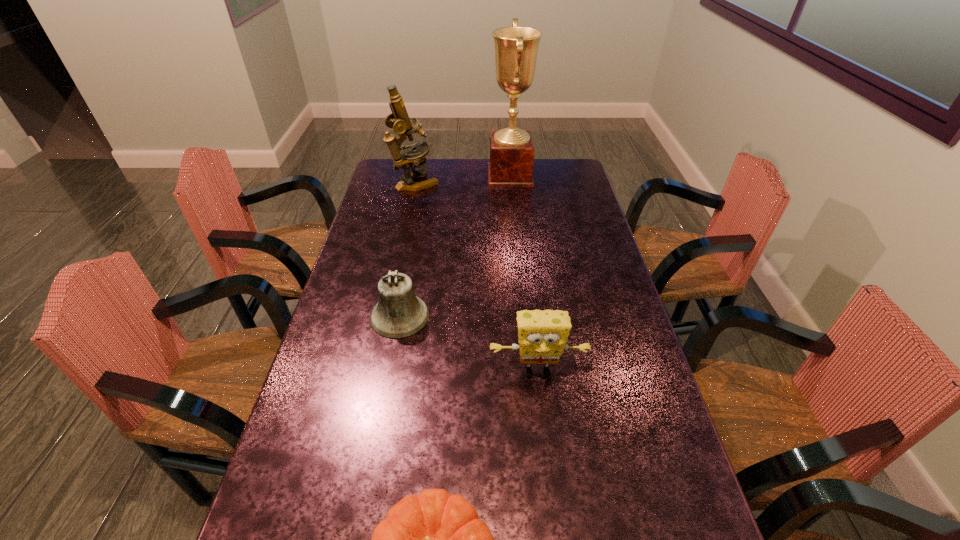
Find the location of a particular element. trophy cup that is at the far edge is located at coordinates (512, 151).

The height and width of the screenshot is (540, 960). Identify the location of microscope present at the far edge. (399, 120).

The width and height of the screenshot is (960, 540). Identify the location of microscope that is at the left edge. (399, 120).

Identify the location of bell located at the left edge. The height and width of the screenshot is (540, 960). (398, 314).

This screenshot has height=540, width=960. Find the location of `object present at the far left corner`. object present at the far left corner is located at coordinates (399, 120).

In the image, there is a desktop. Where is `vacant space at the far edge`? The height and width of the screenshot is (540, 960). vacant space at the far edge is located at coordinates (428, 176).

The height and width of the screenshot is (540, 960). Identify the location of free region at the left edge of the desktop. (386, 200).

The width and height of the screenshot is (960, 540). I want to click on vacant area at the right edge of the desktop, so click(608, 294).

In the image, there is a desktop. Identify the location of vacant space at the far left corner. This screenshot has height=540, width=960. (399, 174).

Locate an element on the screen. This screenshot has width=960, height=540. vacant point located between the fourth shortest object and the third farthest object is located at coordinates (408, 249).